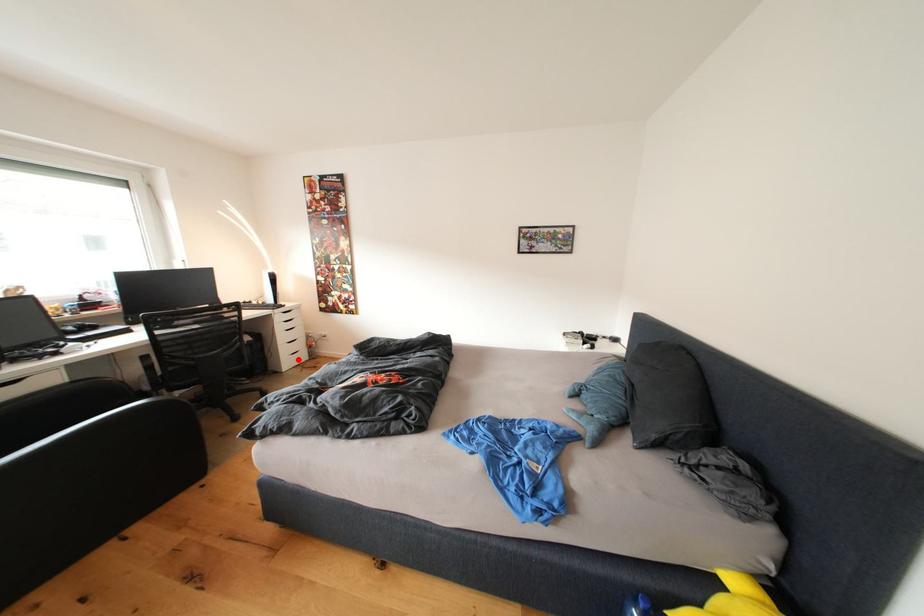
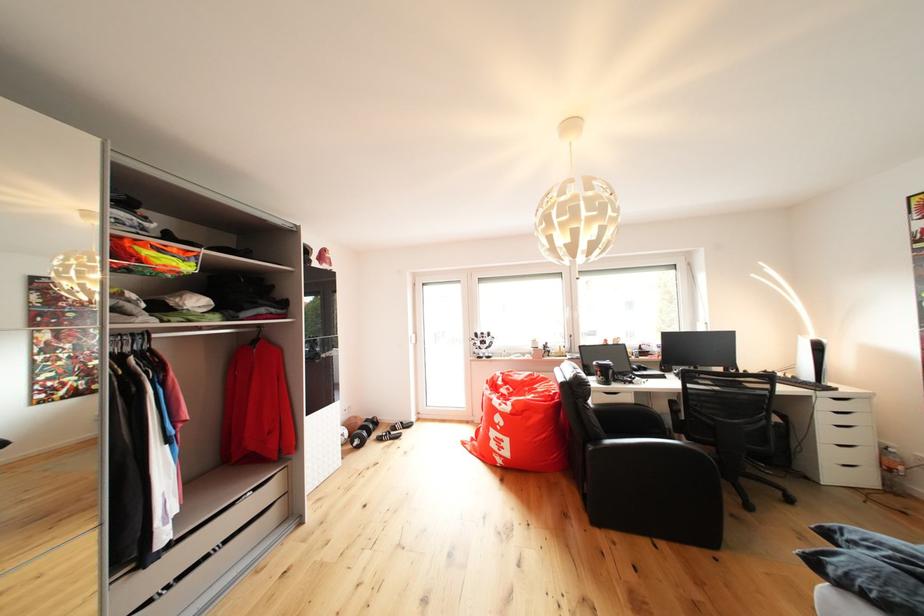
Question: I am providing you with two images of the same scene from different viewpoints. Image1 has a red point marked. In image2, the corresponding 3D location appears at what relative position? Reply with the corresponding letter.

Choices:
 (A) Closer
 (B) Farther

Answer: (A)